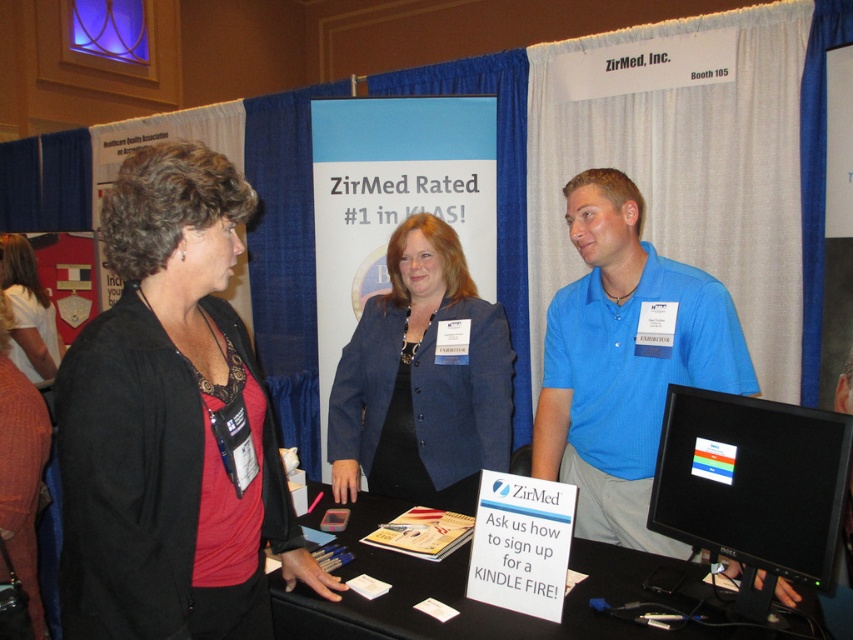
Question: Does blue fabric jacket at center have a smaller size compared to black glossy monitor at right?

Choices:
 (A) no
 (B) yes

Answer: (A)

Question: Does blue shirt at center come behind matte black shirt at left?

Choices:
 (A) no
 (B) yes

Answer: (A)

Question: Which object is the farthest from the blue fabric jacket at center?

Choices:
 (A) black glossy monitor at right
 (B) matte black shirt at left
 (C) blue shirt at center

Answer: (B)

Question: Which point is closer to the camera?

Choices:
 (A) black glossy monitor at right
 (B) blue shirt at center
 (C) black plastic table at center

Answer: (A)

Question: Considering the relative positions of matte black blazer at center and black plastic table at center in the image provided, where is matte black blazer at center located with respect to black plastic table at center?

Choices:
 (A) above
 (B) below

Answer: (A)

Question: Which object is closer to the camera taking this photo?

Choices:
 (A) matte black blazer at center
 (B) black plastic table at center

Answer: (A)